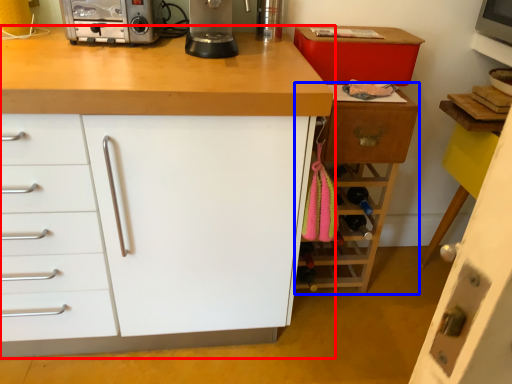
Question: Which point is closer to the camera, cabinetry (highlighted by a red box) or cabinetry (highlighted by a blue box)?

Choices:
 (A) cabinetry
 (B) cabinetry

Answer: (A)